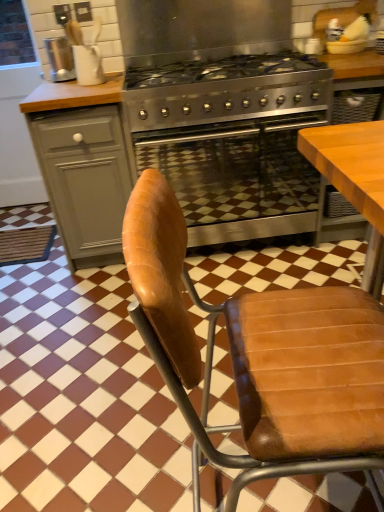
The height and width of the screenshot is (512, 384). What do you see at coordinates (227, 91) in the screenshot?
I see `stainless steel gas stove at center` at bounding box center [227, 91].

Describe the element at coordinates (60, 59) in the screenshot. I see `metallic silver kettle at upper left` at that location.

Where is `stainless steel gas stove at center`? The image size is (384, 512). stainless steel gas stove at center is located at coordinates (227, 91).

Is white matte mug at upper left thinner than metallic silver kettle at upper left?

In fact, white matte mug at upper left might be wider than metallic silver kettle at upper left.

Does white matte mug at upper left turn towards metallic silver kettle at upper left?

No, white matte mug at upper left is not oriented towards metallic silver kettle at upper left.

From the image's perspective, is white matte mug at upper left on top of metallic silver kettle at upper left?

No, from the image's perspective, white matte mug at upper left is not above metallic silver kettle at upper left.

Does point (83, 46) come in front of point (64, 52)?

Yes, point (83, 46) is closer to viewer.

From the picture: In terms of size, does stainless steel gas stove at center appear bigger or smaller than metallic silver kettle at upper left?

stainless steel gas stove at center is bigger than metallic silver kettle at upper left.

Is stainless steel gas stove at center positioned beyond the bounds of metallic silver kettle at upper left?

Indeed, stainless steel gas stove at center is completely outside metallic silver kettle at upper left.

Looking at this image, can you confirm if stainless steel gas stove at center is thinner than metallic silver kettle at upper left?

Incorrect, the width of stainless steel gas stove at center is not less than that of metallic silver kettle at upper left.

Based on the photo, would you say stainless steel gas stove at center is a long distance from metallic silver kettle at upper left?

No, stainless steel gas stove at center is not far from metallic silver kettle at upper left.

Is brown leather chair at center touching stainless steel oven at center?

brown leather chair at center is not next to stainless steel oven at center, and they're not touching.

Considering the relative positions of brown leather chair at center and stainless steel oven at center in the image provided, is brown leather chair at center to the right of stainless steel oven at center from the viewer's perspective?

Correct, you'll find brown leather chair at center to the right of stainless steel oven at center.

Can stainless steel oven at center be found inside brown leather chair at center?

Definitely not — stainless steel oven at center is not inside brown leather chair at center.

The height and width of the screenshot is (512, 384). In order to click on oven behind the brown leather chair at center in this screenshot , I will do `click(236, 180)`.

Which object is further away from the camera, metallic silver kettle at upper left or matte gray cabinet at left?

Positioned behind is metallic silver kettle at upper left.

Which point is more forward, (60, 55) or (50, 190)?

The point (50, 190) is in front.

From a real-world perspective, who is located higher, metallic silver kettle at upper left or matte gray cabinet at left?

metallic silver kettle at upper left is physically above.

Who is taller, metallic silver kettle at upper left or matte gray cabinet at left?

matte gray cabinet at left.

Does point (100, 65) come behind point (257, 366)?

Yes, point (100, 65) is behind point (257, 366).

Is white matte mug at upper left inside the boundaries of brown leather chair at center, or outside?

The correct answer is: outside.

In the scene shown: Which of these two, white matte mug at upper left or brown leather chair at center, is thinner?

Thinner between the two is white matte mug at upper left.

Is white matte mug at upper left next to brown leather chair at center and touching it?

No, white matte mug at upper left is not next to brown leather chair at center.

In the scene shown: Would you say white matte mug at upper left is a long distance from stainless steel gas stove at center?

Actually, white matte mug at upper left and stainless steel gas stove at center are a little close together.

Is white matte mug at upper left positioned in front of stainless steel gas stove at center?

No, it is not.

Which object is positioned more to the left, white matte mug at upper left or stainless steel gas stove at center?

Positioned to the left is white matte mug at upper left.

Is point (93, 76) closer or farther from the camera than point (288, 55)?

Point (93, 76).

From the picture: Between stainless steel gas stove at center and matte gray cabinet at left, which one has less height?

stainless steel gas stove at center is shorter.

Is the surface of stainless steel gas stove at center in direct contact with matte gray cabinet at left?

stainless steel gas stove at center is not next to matte gray cabinet at left, and they're not touching.

Considering the relative sizes of stainless steel gas stove at center and matte gray cabinet at left in the image provided, is stainless steel gas stove at center wider than matte gray cabinet at left?

Correct, the width of stainless steel gas stove at center exceeds that of matte gray cabinet at left.

The image size is (384, 512). In the image, there is a white matte mug at upper left. In order to click on appliance above it (from the image's perspective) in this screenshot , I will do `click(60, 59)`.

You are a GUI agent. You are given a task and a screenshot of the screen. Output one action in this format:
    pyautogui.click(x=<x>, y=<y>)
    Task: Click on the appliance behind the stainless steel gas stove at center
    This screenshot has height=512, width=384.
    Given the screenshot: What is the action you would take?
    pyautogui.click(x=60, y=59)

From the image, which object appears to be farther from stainless steel oven at center, metallic silver kettle at upper left or stainless steel gas stove at center?

metallic silver kettle at upper left lies further to stainless steel oven at center than the other object.

When comparing their distances from metallic silver kettle at upper left, does stainless steel oven at center or stainless steel gas stove at center seem further?

stainless steel oven at center is positioned further to the anchor metallic silver kettle at upper left.

Based on their spatial positions, is white matte mug at upper left or metallic silver kettle at upper left further from brown leather chair at center?

metallic silver kettle at upper left lies further to brown leather chair at center than the other object.

When comparing their distances from brown leather chair at center, does white matte mug at upper left or matte gray cabinet at left seem further?

white matte mug at upper left is further to brown leather chair at center.

Considering their positions, is stainless steel gas stove at center positioned closer to metallic silver kettle at upper left than brown leather chair at center?

stainless steel gas stove at center.

Which object lies nearer to the anchor point metallic silver kettle at upper left, matte gray cabinet at left or white matte mug at upper left?

The object closer to metallic silver kettle at upper left is white matte mug at upper left.

From the image, which object appears to be farther from stainless steel oven at center, brown leather chair at center or metallic silver kettle at upper left?

brown leather chair at center.

Estimate the real-world distances between objects in this image. Which object is closer to brown leather chair at center, metallic silver kettle at upper left or matte gray cabinet at left?

matte gray cabinet at left lies closer to brown leather chair at center than the other object.

This screenshot has width=384, height=512. Find the location of `oven located between brown leather chair at center and white matte mug at upper left in the depth direction`. oven located between brown leather chair at center and white matte mug at upper left in the depth direction is located at coordinates (236, 180).

I want to click on gas stove located between brown leather chair at center and matte gray cabinet at left in the depth direction, so click(x=227, y=91).

The width and height of the screenshot is (384, 512). I want to click on gas stove located between white matte mug at upper left and stainless steel oven at center in the left-right direction, so (x=227, y=91).

Image resolution: width=384 pixels, height=512 pixels. I want to click on cabinetry between brown leather chair at center and white matte mug at upper left in the front-back direction, so click(85, 179).